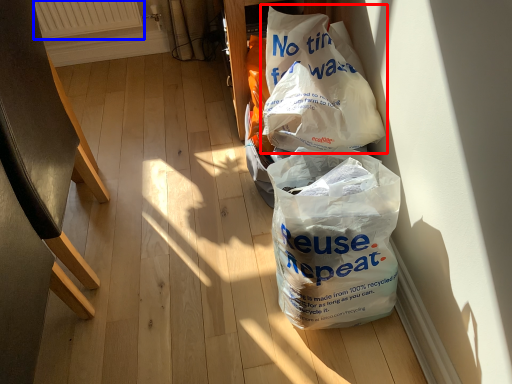
Question: Which object is closer to the camera taking this photo, plastic bag (highlighted by a red box) or radiator (highlighted by a blue box)?

Choices:
 (A) plastic bag
 (B) radiator

Answer: (A)